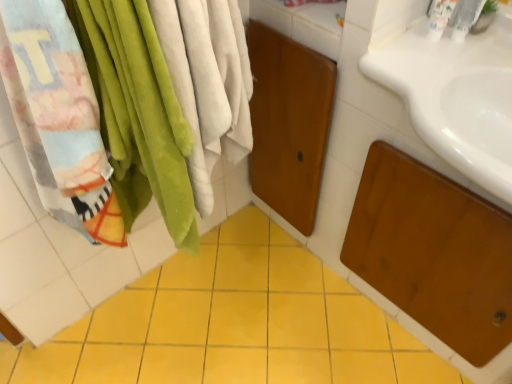
Where is `blank space situated above yellow ceramic tile at center (from a real-world perspective)`? Image resolution: width=512 pixels, height=384 pixels. blank space situated above yellow ceramic tile at center (from a real-world perspective) is located at coordinates [x=223, y=319].